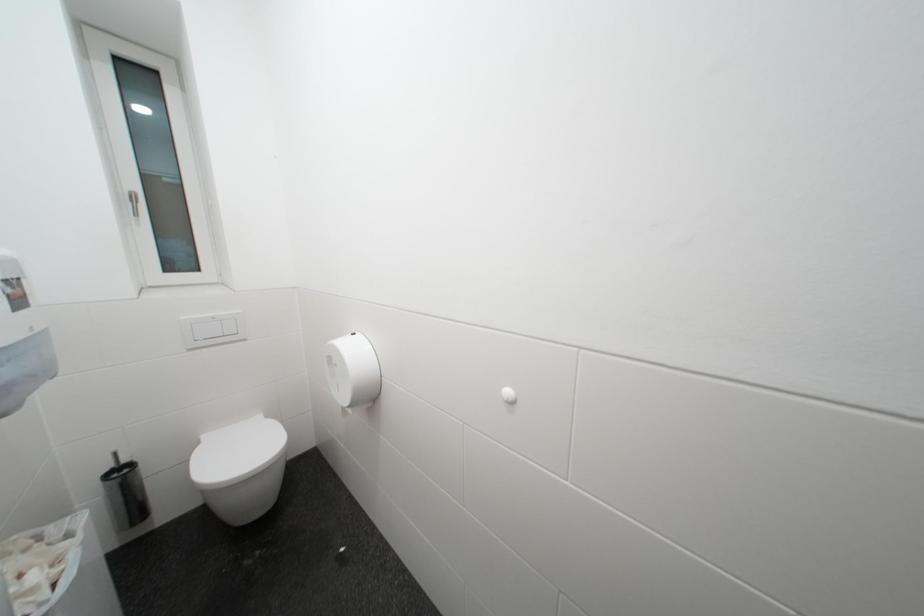
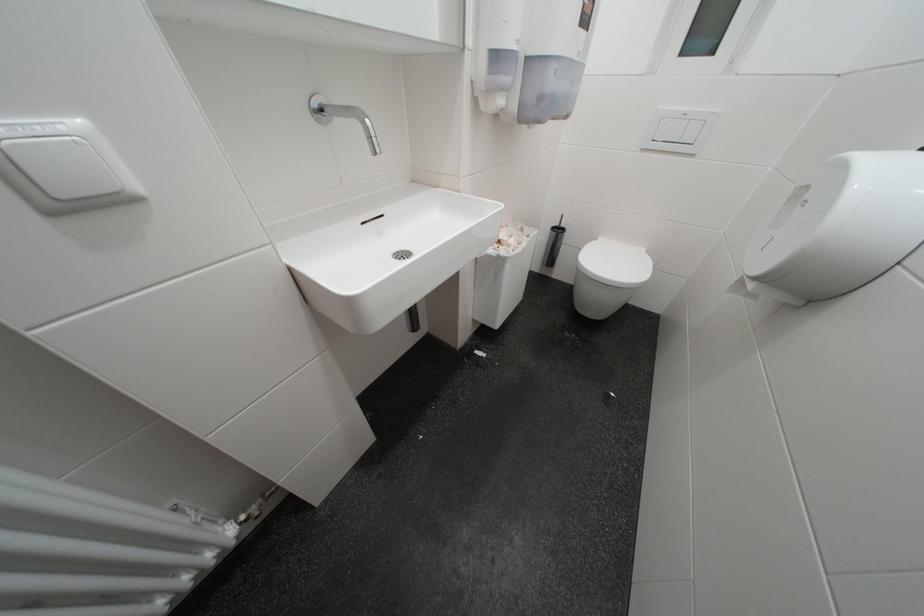
The first image is from the beginning of the video and the second image is from the end. How did the camera likely rotate when shooting the video?

The rotation direction of the camera is left-down.